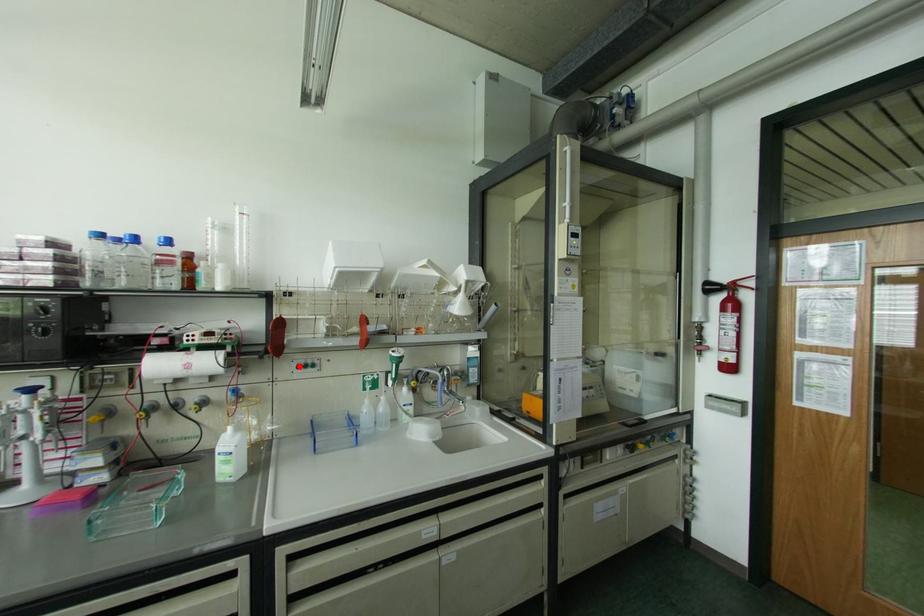
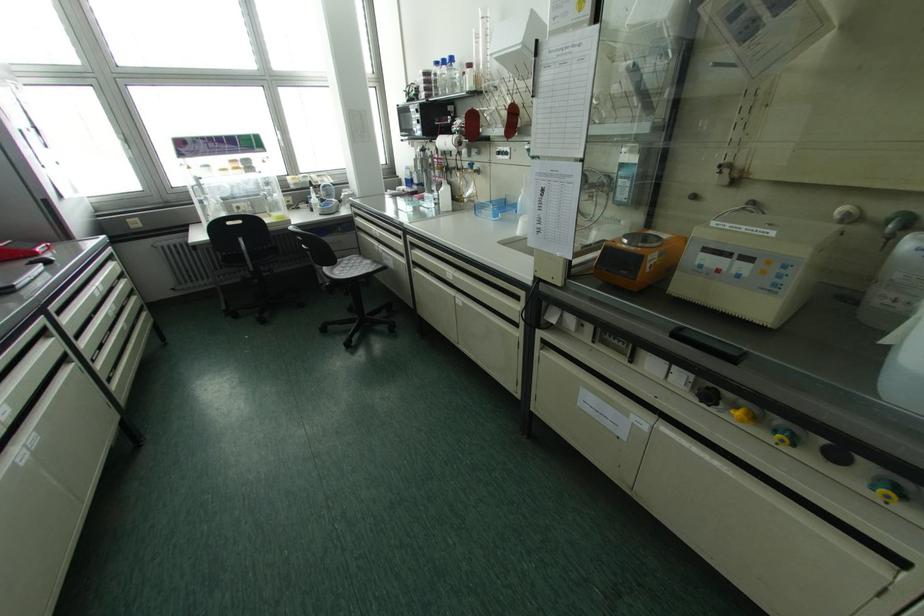
Locate, in the second image, the point that corresponds to the highlighted location in the first image.

(497, 153)